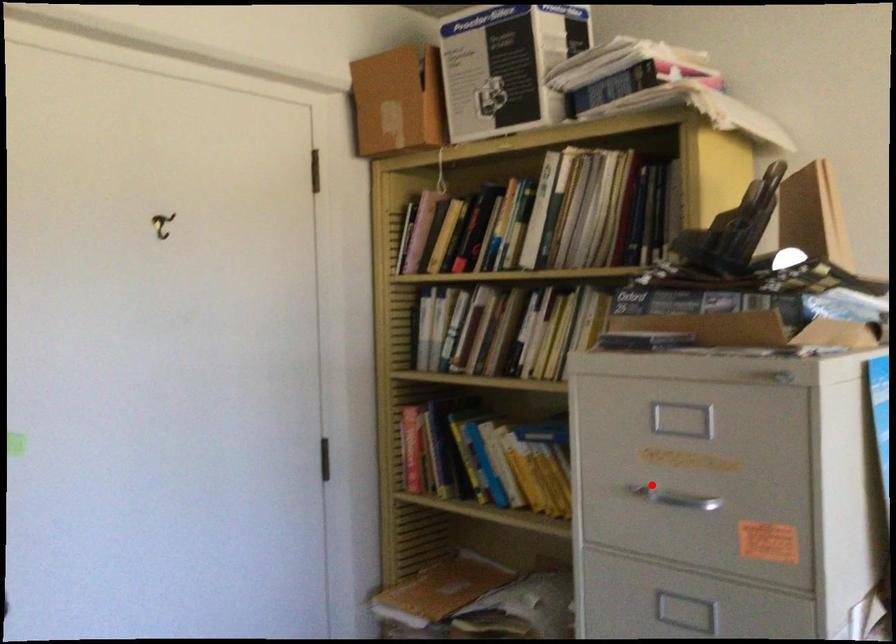
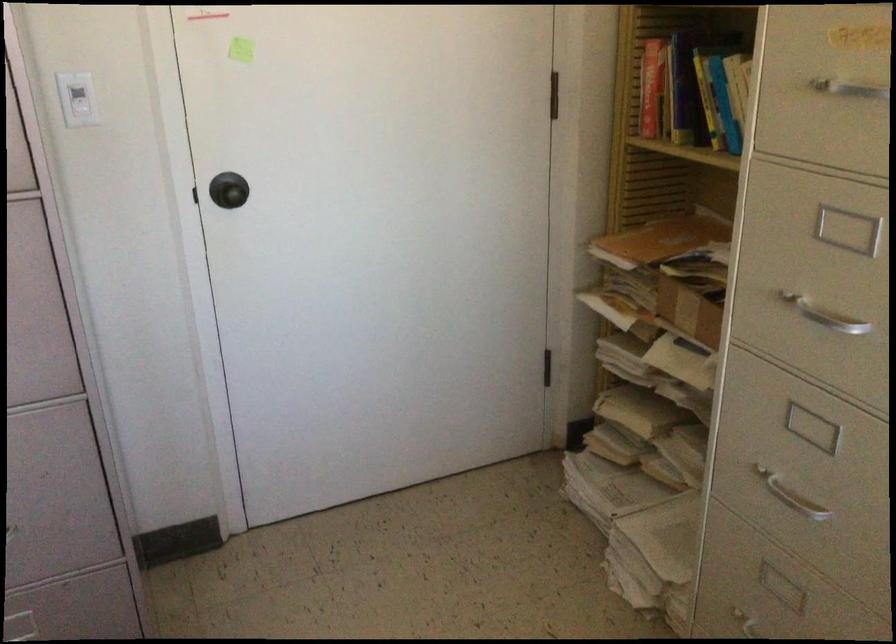
Question: A red point is marked in image1. In image2, is the corresponding 3D point closer to the camera or farther? Reply with the corresponding letter.

Choices:
 (A) The corresponding 3D point is closer.
 (B) The corresponding 3D point is farther.

Answer: (A)